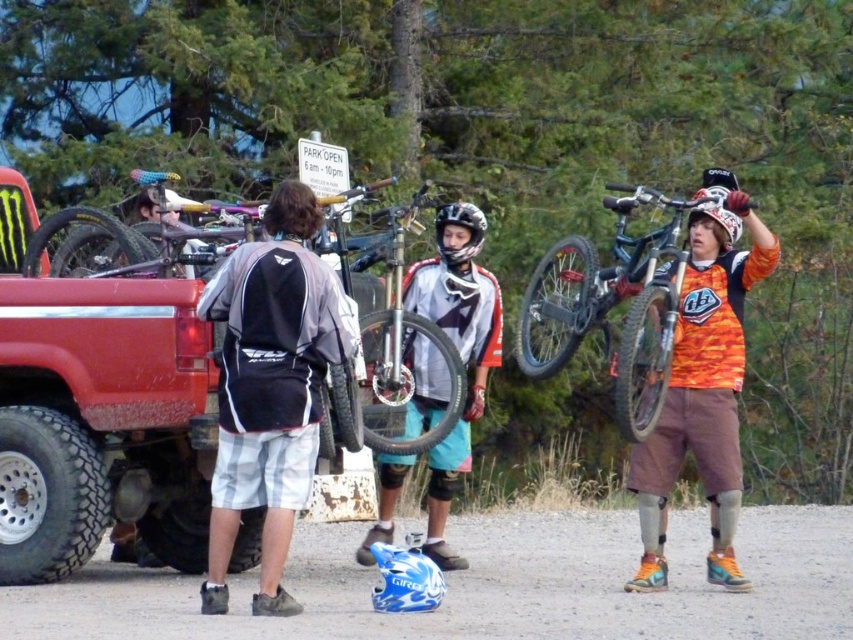
You are a photographer at the mountain biking event. You need to capture a photo that includes both the shiny metallic bicycle at upper right and the brown hair at center. Based on their positions, which object should be placed lower in the frame to ensure both are visible?

The shiny metallic bicycle at upper right is below brown hair at center, so to include both in the frame, the brown hair at center should be placed higher and the shiny metallic bicycle at upper right lower in the frame.

You are a participant in the mountain biking event and need to choose between the shiny metallic bicycle at upper right and the matte black helmet at center. Which item is taller?

The shiny metallic bicycle at upper right is taller than the matte black helmet at center.

You are standing at point (287, 180) and want to walk to point (590, 266). Is the path blocked by the red pickup truck parked on the gravel?

Point (590, 266) is behind point (287, 180), so the path is blocked by the red pickup truck parked on the gravel.